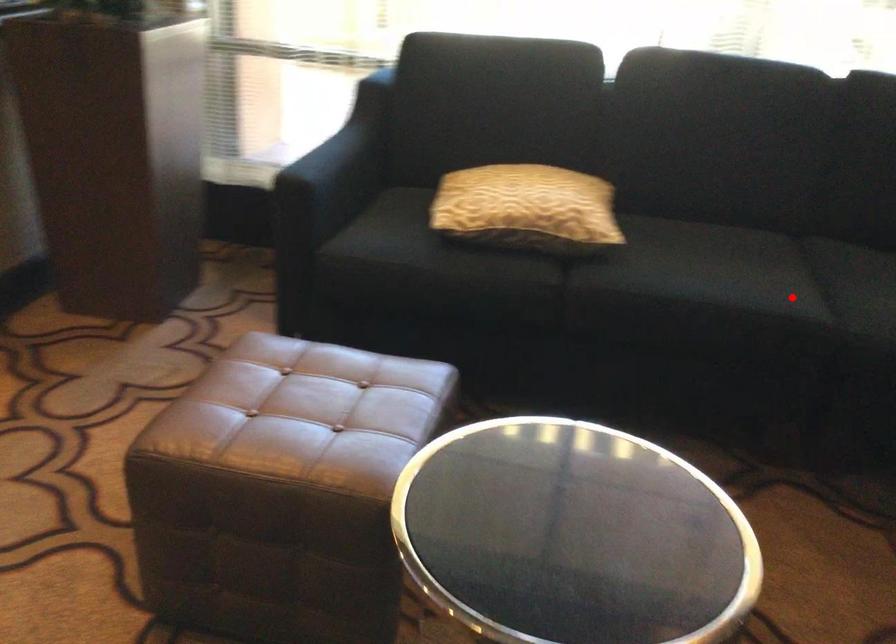
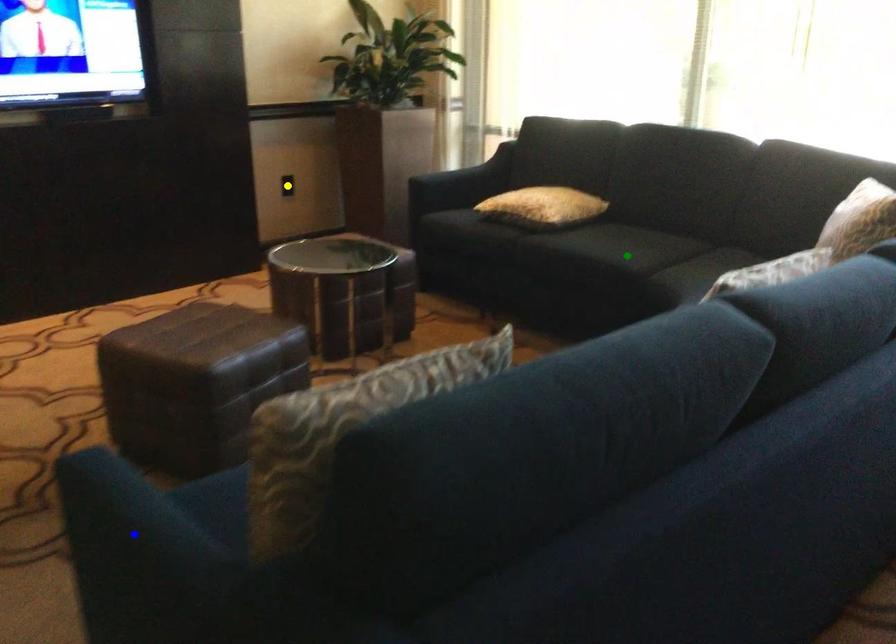
Question: I am providing you with two images of the same scene from different viewpoints. A red point is marked on the first image. You are given multiple points on the second image. Which spot in image 2 lines up with the point in image 1?

Choices:
 (A) blue point
 (B) yellow point
 (C) green point

Answer: (C)